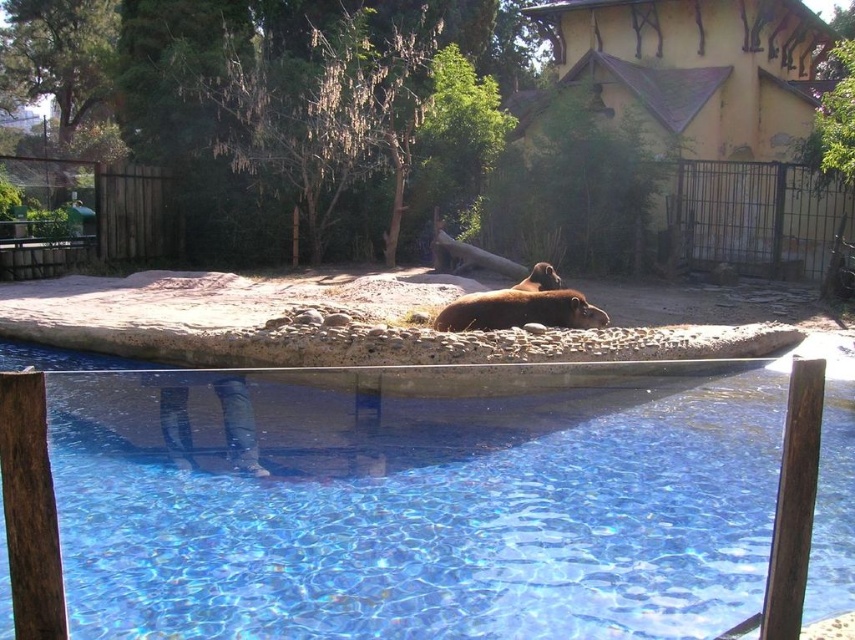
Is transparent glass swimming pool at center shorter than brown fur bear at center?

No, transparent glass swimming pool at center is not shorter than brown fur bear at center.

Find the location of a particular element. transparent glass swimming pool at center is located at coordinates (416, 500).

Which is in front, point (569, 582) or point (513, 316)?

Point (569, 582)

Find the location of a particular element. transparent glass swimming pool at center is located at coordinates (416, 500).